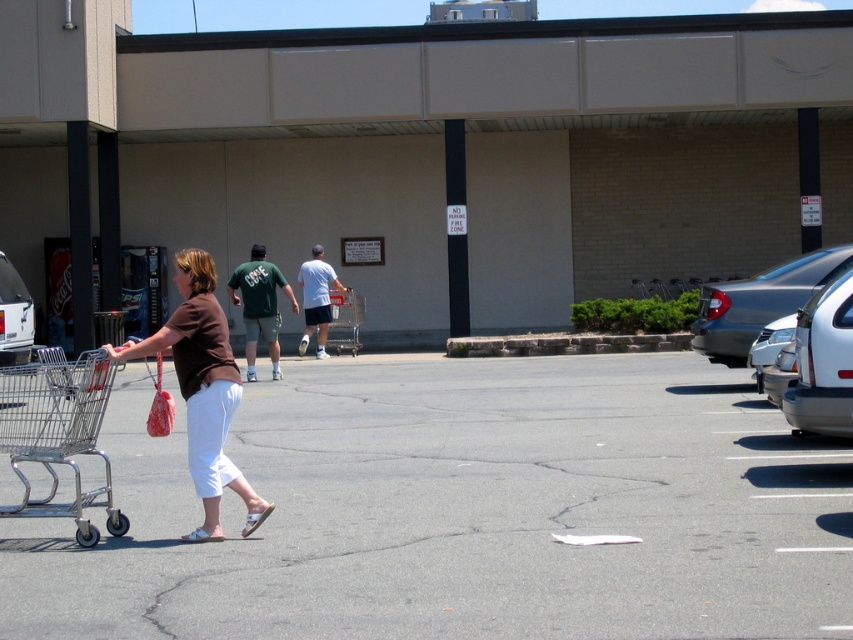
Can you confirm if brown fabric shirt at center is positioned below green fabric shirt at center?

No, brown fabric shirt at center is not below green fabric shirt at center.

Which is in front, point (219, 412) or point (276, 317)?

Point (219, 412) is in front.

This screenshot has width=853, height=640. I want to click on brown fabric shirt at center, so click(x=202, y=388).

Measure the distance from brown fabric shirt at center to silver metallic suv at right.

brown fabric shirt at center is 4.41 meters from silver metallic suv at right.

Does brown fabric shirt at center come in front of silver metallic suv at right?

Yes.

Between point (200, 397) and point (831, 355), which one is positioned in front?

Positioned in front is point (200, 397).

What are the coordinates of `brown fabric shirt at center` in the screenshot? It's located at (202, 388).

How much distance is there between silver metallic suv at right and white glossy car at center?

silver metallic suv at right is 10.30 meters from white glossy car at center.

Is the position of silver metallic suv at right less distant than that of white glossy car at center?

Yes, it is.

The height and width of the screenshot is (640, 853). I want to click on silver metallic suv at right, so click(x=822, y=364).